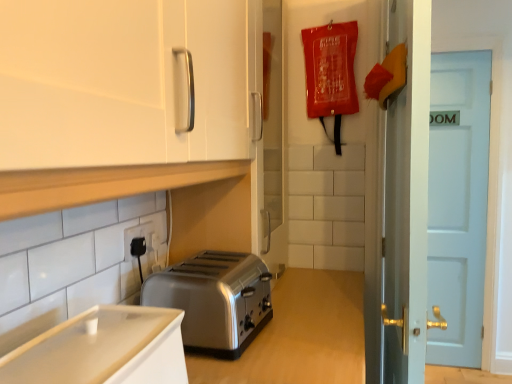
Question: Is black plastic electric outlet at lower left shorter than white glossy cabinet at upper left, which is the 1th cabinetry from top to bottom?

Choices:
 (A) no
 (B) yes

Answer: (B)

Question: Does black plastic electric outlet at lower left appear on the left side of white glossy cabinet at upper left, arranged as the 2th cabinetry when ordered from the bottom?

Choices:
 (A) yes
 (B) no

Answer: (A)

Question: Is the position of black plastic electric outlet at lower left less distant than that of white glossy cabinet at upper left, which is the 1th cabinetry from top to bottom?

Choices:
 (A) no
 (B) yes

Answer: (A)

Question: Is there a large distance between black plastic electric outlet at lower left and white glossy cabinet at upper left, which is the 1th cabinetry from top to bottom?

Choices:
 (A) yes
 (B) no

Answer: (B)

Question: Is black plastic electric outlet at lower left taller than white glossy cabinet at upper left, which is the 1th cabinetry from top to bottom?

Choices:
 (A) yes
 (B) no

Answer: (B)

Question: Is black plastic electric outlet at lower left surrounding white glossy cabinet at upper left, arranged as the 2th cabinetry when ordered from the bottom?

Choices:
 (A) no
 (B) yes

Answer: (A)

Question: Does white glossy cabinet at upper left, which is the 1th cabinetry from top to bottom, appear on the left side of white glossy cabinet at lower left, the second cabinetry viewed from the top?

Choices:
 (A) yes
 (B) no

Answer: (A)

Question: Can we say white glossy cabinet at upper left, arranged as the 2th cabinetry when ordered from the bottom, lies outside white glossy cabinet at lower left, the second cabinetry viewed from the top?

Choices:
 (A) yes
 (B) no

Answer: (A)

Question: Can you confirm if white glossy cabinet at upper left, arranged as the 2th cabinetry when ordered from the bottom, is bigger than white glossy cabinet at lower left, the first cabinetry when ordered from bottom to top?

Choices:
 (A) no
 (B) yes

Answer: (B)

Question: Does white glossy cabinet at upper left, arranged as the 2th cabinetry when ordered from the bottom, have a lesser width compared to white glossy cabinet at lower left, the first cabinetry when ordered from bottom to top?

Choices:
 (A) yes
 (B) no

Answer: (B)

Question: Is white glossy cabinet at upper left, arranged as the 2th cabinetry when ordered from the bottom, directly adjacent to white glossy cabinet at lower left, the first cabinetry when ordered from bottom to top?

Choices:
 (A) no
 (B) yes

Answer: (A)

Question: From a real-world perspective, is white glossy cabinet at upper left, arranged as the 2th cabinetry when ordered from the bottom, located beneath white glossy cabinet at lower left, the second cabinetry viewed from the top?

Choices:
 (A) no
 (B) yes

Answer: (A)

Question: From a real-world perspective, is white glossy cabinet at lower left, the first cabinetry when ordered from bottom to top, positioned under white wooden door at right based on gravity?

Choices:
 (A) no
 (B) yes

Answer: (A)